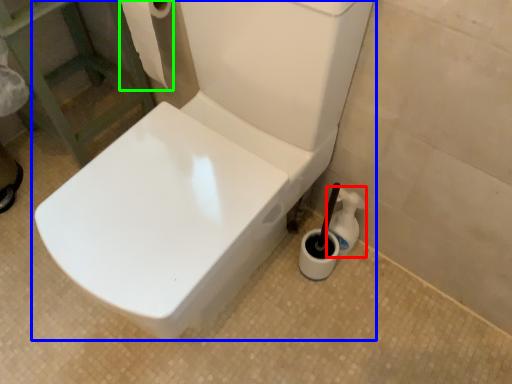
Question: Which is nearer to the cleaning product (highlighted by a red box)? toilet (highlighted by a blue box) or toilet paper (highlighted by a green box).

Choices:
 (A) toilet
 (B) toilet paper

Answer: (A)